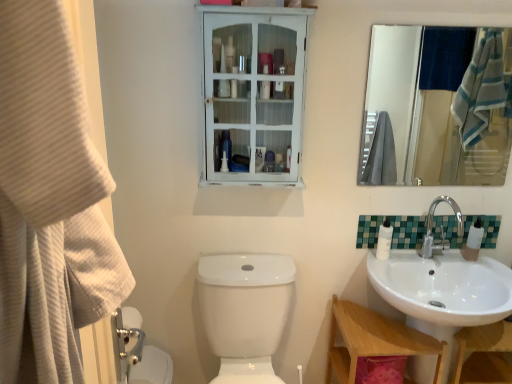
Question: From a real-world perspective, is chrome metallic faucet at right located higher than translucent plastic soap dispenser at sink right?

Choices:
 (A) yes
 (B) no

Answer: (A)

Question: Can you confirm if chrome metallic faucet at right is thinner than translucent plastic soap dispenser at sink right?

Choices:
 (A) yes
 (B) no

Answer: (B)

Question: Is translucent plastic soap dispenser at sink right a part of chrome metallic faucet at right?

Choices:
 (A) no
 (B) yes

Answer: (A)

Question: Can you confirm if chrome metallic faucet at right is shorter than translucent plastic soap dispenser at sink right?

Choices:
 (A) no
 (B) yes

Answer: (A)

Question: Is the surface of chrome metallic faucet at right in direct contact with translucent plastic soap dispenser at sink right?

Choices:
 (A) no
 (B) yes

Answer: (A)

Question: Is point (289, 82) positioned closer to the camera than point (46, 84)?

Choices:
 (A) closer
 (B) farther

Answer: (B)

Question: In terms of width, does white distressed wood medicine cabinet at upper center look wider or thinner when compared to beige textured towel at left?

Choices:
 (A) thin
 (B) wide

Answer: (A)

Question: In the image, is white distressed wood medicine cabinet at upper center positioned in front of or behind beige textured towel at left?

Choices:
 (A) front
 (B) behind

Answer: (B)

Question: Considering the positions of white distressed wood medicine cabinet at upper center and beige textured towel at left in the image, is white distressed wood medicine cabinet at upper center taller or shorter than beige textured towel at left?

Choices:
 (A) tall
 (B) short

Answer: (A)

Question: Is translucent plastic soap dispenser at sink right situated inside white glossy lotion at right or outside?

Choices:
 (A) outside
 (B) inside

Answer: (A)

Question: Considering the positions of translucent plastic soap dispenser at sink right and white glossy lotion at right in the image, is translucent plastic soap dispenser at sink right wider or thinner than white glossy lotion at right?

Choices:
 (A) thin
 (B) wide

Answer: (B)

Question: Relative to white glossy lotion at right, is translucent plastic soap dispenser at sink right in front or behind?

Choices:
 (A) behind
 (B) front

Answer: (A)

Question: Considering the positions of translucent plastic soap dispenser at sink right and white glossy lotion at right in the image, is translucent plastic soap dispenser at sink right bigger or smaller than white glossy lotion at right?

Choices:
 (A) small
 (B) big

Answer: (B)

Question: Does point (221, 102) appear closer or farther from the camera than point (390, 235)?

Choices:
 (A) farther
 (B) closer

Answer: (B)

Question: In the image, is white distressed wood medicine cabinet at upper center on the left side or the right side of white glossy lotion at right?

Choices:
 (A) right
 (B) left

Answer: (B)